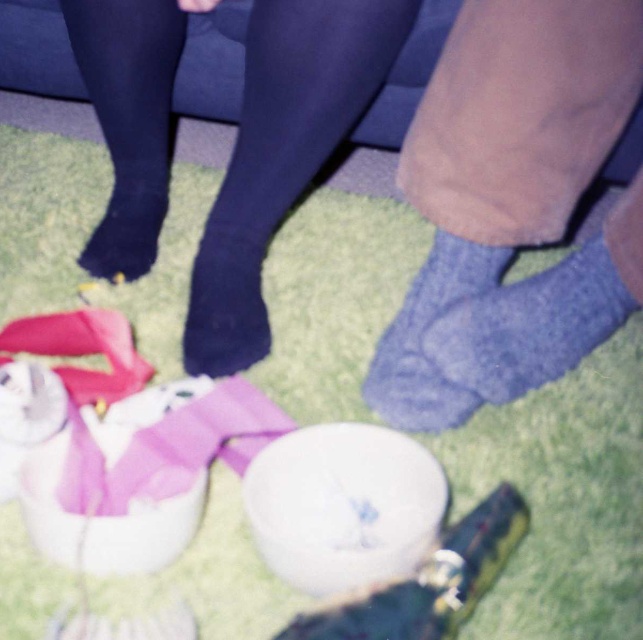
You are organizing a picnic and need to place the blue knitted socks at lower right and the knitted blue sock at lower center into a small bag. Which sock should you place first to ensure both fit?

The knitted blue sock at lower center should be placed first since it is smaller than the blue knitted socks at lower right, allowing more space for the larger sock afterward.

You are standing in the scene and want to place a small object on the ground. You have two points to choose from. The first point is point [532,100] and the second is point [365,392]. Which point is closer to you?

Point [532,100] is closer to the viewer than point [365,392], so you should choose that point to place the object.

You are standing at the origin point in the image. There is a point at coordinates (512,205). Which object is this point located on?

The point at coordinates (512,205) is located on the blue knitted socks at lower right.